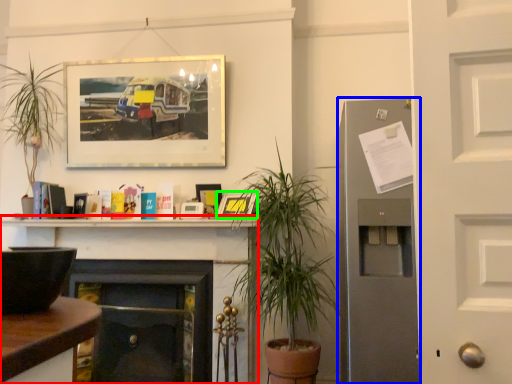
Question: Based on their relative distances, which object is nearer to fireplace (highlighted by a red box)? Choose from fireplace (highlighted by a blue box) and picture frame (highlighted by a green box).

Choices:
 (A) fireplace
 (B) picture frame

Answer: (B)